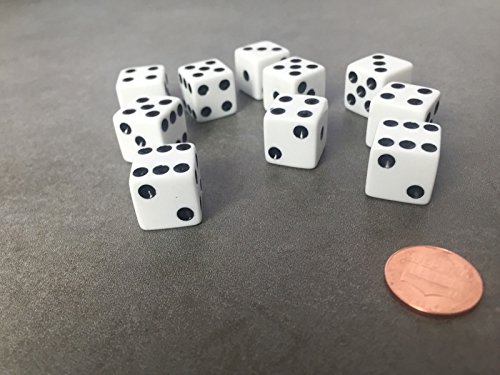
The height and width of the screenshot is (375, 500). In order to click on table top in this screenshot , I will do [132, 276].